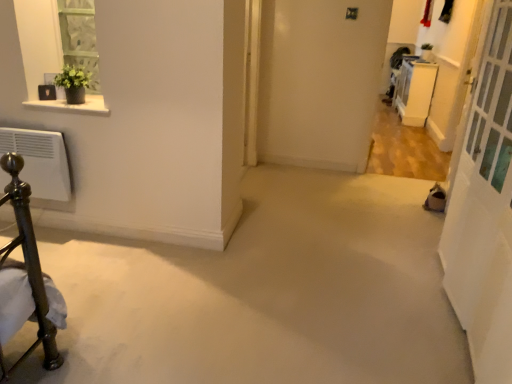
Question: Is white glass screen door at right closer to the viewer compared to white glossy cabinet at upper right?

Choices:
 (A) yes
 (B) no

Answer: (A)

Question: Is white glossy cabinet at upper right completely or partially inside white glass screen door at right?

Choices:
 (A) yes
 (B) no

Answer: (B)

Question: From the image's perspective, is white glass screen door at right located above white glossy cabinet at upper right?

Choices:
 (A) no
 (B) yes

Answer: (A)

Question: Is white glass screen door at right oriented away from white glossy cabinet at upper right?

Choices:
 (A) yes
 (B) no

Answer: (B)

Question: From the image's perspective, would you say white glass screen door at right is shown under white glossy cabinet at upper right?

Choices:
 (A) yes
 (B) no

Answer: (A)

Question: Can you confirm if white glass screen door at right is shorter than white glossy cabinet at upper right?

Choices:
 (A) yes
 (B) no

Answer: (B)

Question: Does white glossy cabinet at upper right touch white marble shelf at upper left?

Choices:
 (A) yes
 (B) no

Answer: (B)

Question: Is the position of white glossy cabinet at upper right less distant than that of white marble shelf at upper left?

Choices:
 (A) no
 (B) yes

Answer: (A)

Question: From the image's perspective, is white glossy cabinet at upper right on top of white marble shelf at upper left?

Choices:
 (A) yes
 (B) no

Answer: (A)

Question: Is white glossy cabinet at upper right looking in the opposite direction of white marble shelf at upper left?

Choices:
 (A) no
 (B) yes

Answer: (A)

Question: Is white glossy cabinet at upper right positioned far away from white marble shelf at upper left?

Choices:
 (A) yes
 (B) no

Answer: (A)

Question: From a real-world perspective, does white glossy cabinet at upper right stand above white marble shelf at upper left?

Choices:
 (A) yes
 (B) no

Answer: (B)

Question: Is white glossy cabinet at upper right looking in the opposite direction of white glass screen door at right?

Choices:
 (A) no
 (B) yes

Answer: (A)